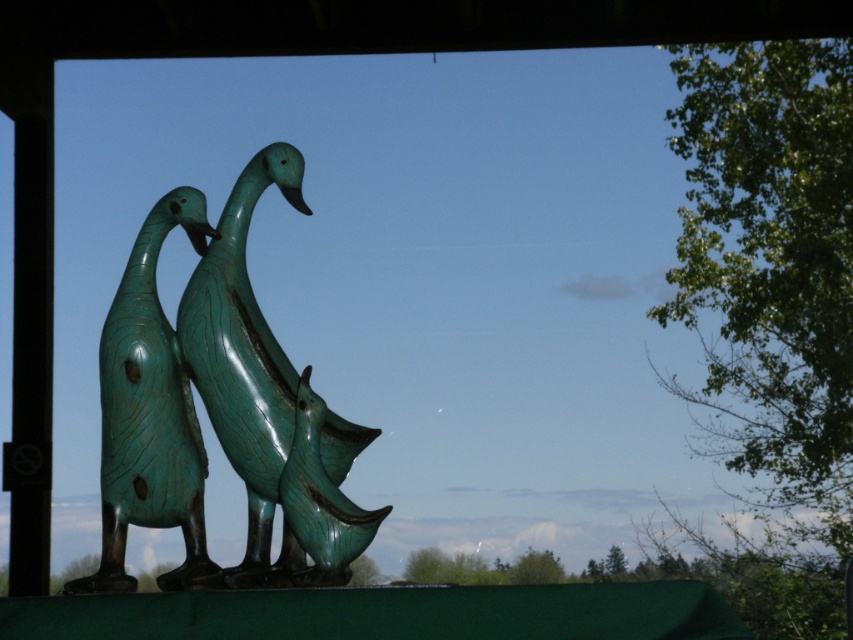
You are standing in front of the three sculptures of geese. You want to place a new sculpture exactly between the green patina sculpture at center and the edge of the row. Where should you place it?

The green patina sculpture at center is located at point (270, 404). To place a new sculpture exactly between it and the edge of the row, you would need to calculate the midpoint between the sculpture and the edge. However, without knowing the exact coordinates of the edge, it is impossible to determine the precise placement. Please provide the coordinates of the edge to proceed.

You are standing in front of the three sculptures of geese. There are two points marked on the geese sculptures. One is at point coordinates point (254, 561) and the other is at point coordinates point (303, 545). Which point is closer to you?

Point (303, 545) is closer to you because it is less further to the camera than point (254, 561).

You are an art conservator assessing the sculptures in the image. You need to determine which material is more weathered between the green patinated bronze ducks at left and the green patinated wood duck at center. Based on their sizes, can you infer which one might have been exposed to the elements longer?

The green patinated bronze ducks at left are larger in size than the green patinated wood duck at center. Since bronze patina forms over time due to oxidation, a larger patina might indicate longer exposure. However, the wood duck is smaller, but wood typically weathers faster and may deteriorate more visibly. Therefore, the bronze ducks likely have been exposed longer.